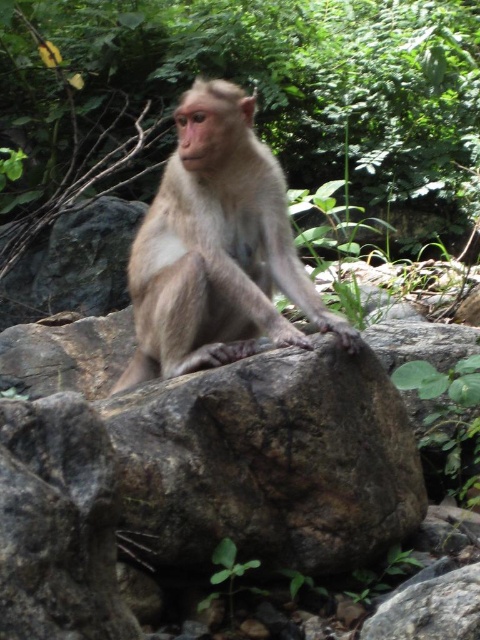
Question: Does green leafy tree at center have a greater width compared to furry beige monkey at center?

Choices:
 (A) yes
 (B) no

Answer: (A)

Question: Which of the following is the closest to the observer?

Choices:
 (A) (284, 204)
 (B) (219, 1)

Answer: (A)

Question: Is green leafy tree at center to the right of furry beige monkey at center from the viewer's perspective?

Choices:
 (A) no
 (B) yes

Answer: (B)

Question: Is green leafy tree at center to the left of furry beige monkey at center from the viewer's perspective?

Choices:
 (A) yes
 (B) no

Answer: (B)

Question: Which point is farther from the camera taking this photo?

Choices:
 (A) (192, 49)
 (B) (287, 336)

Answer: (A)

Question: Which object appears closest to the camera in this image?

Choices:
 (A) green leafy tree at center
 (B) furry beige monkey at center

Answer: (B)